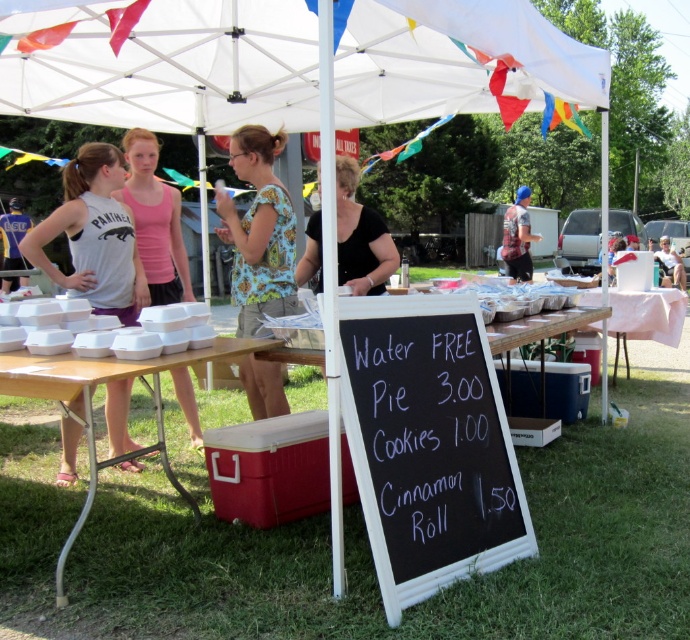
You are at the outdoor event and want to grab a cold drink from the white plastic cooler at lower center. However, you notice the blue knit cap at upper center is directly above it. Will you be able to access the cooler without moving the cap?

The white plastic cooler at lower center is positioned under the blue knit cap at upper center, so you can access the cooler without needing to move the cap as it is placed below it.

You are at the outdoor event and want to see both the floral fabric blouse at center and the black matte shirt at center clearly. Which one is easier to see because it is closer to you?

The floral fabric blouse at center is easier to see because it is in front of the black matte shirt at center, making it closer to you.

You are at the outdoor event and want to read the prices on the black chalkboard at center. Since you are wearing the black matte shirt at center, will the shirt block your view of the chalkboard?

The black chalkboard at center is larger than the black matte shirt at center, so the shirt will not completely block your view of the chalkboard.